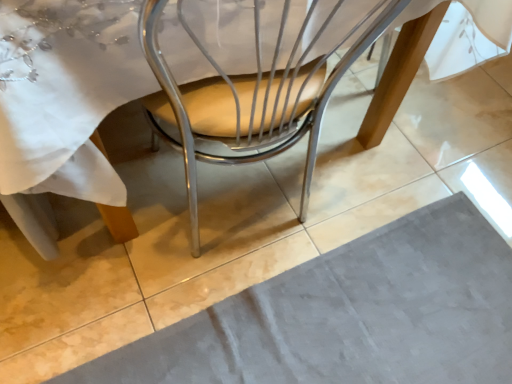
Question: Is gray velvety place mat at lower center far away from metallic tan chair at center?

Choices:
 (A) yes
 (B) no

Answer: (B)

Question: Is the depth of gray velvety place mat at lower center greater than that of metallic tan chair at center?

Choices:
 (A) yes
 (B) no

Answer: (A)

Question: Is gray velvety place mat at lower center outside of metallic tan chair at center?

Choices:
 (A) no
 (B) yes

Answer: (B)

Question: Is the position of gray velvety place mat at lower center less distant than that of metallic tan chair at center?

Choices:
 (A) yes
 (B) no

Answer: (B)

Question: From the image's perspective, does gray velvety place mat at lower center appear lower than metallic tan chair at center?

Choices:
 (A) no
 (B) yes

Answer: (B)

Question: Is gray velvety place mat at lower center bigger than metallic tan chair at center?

Choices:
 (A) no
 (B) yes

Answer: (A)

Question: Is metallic tan chair at center wider than gray velvety place mat at lower center?

Choices:
 (A) no
 (B) yes

Answer: (A)

Question: From the image's perspective, is metallic tan chair at center above gray velvety place mat at lower center?

Choices:
 (A) no
 (B) yes

Answer: (B)

Question: Could you tell me if metallic tan chair at center is facing gray velvety place mat at lower center?

Choices:
 (A) no
 (B) yes

Answer: (B)

Question: Considering the relative sizes of metallic tan chair at center and gray velvety place mat at lower center in the image provided, is metallic tan chair at center taller than gray velvety place mat at lower center?

Choices:
 (A) yes
 (B) no

Answer: (A)

Question: Is the depth of metallic tan chair at center greater than that of gray velvety place mat at lower center?

Choices:
 (A) no
 (B) yes

Answer: (A)

Question: Does metallic tan chair at center lie in front of gray velvety place mat at lower center?

Choices:
 (A) no
 (B) yes

Answer: (B)

Question: Looking at their shapes, would you say gray velvety place mat at lower center is wider or thinner than metallic tan chair at center?

Choices:
 (A) wide
 (B) thin

Answer: (A)